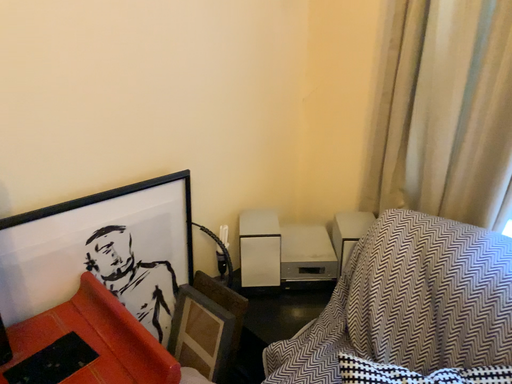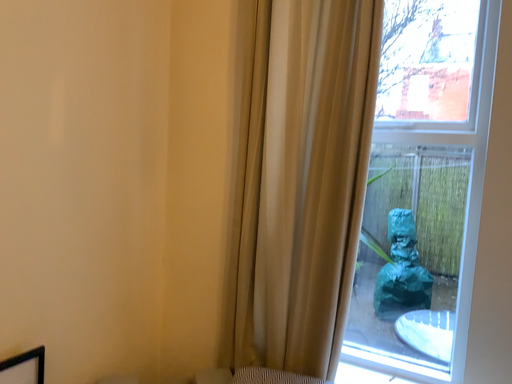
Question: How did the camera likely rotate when shooting the video?

Choices:
 (A) rotated left
 (B) rotated right

Answer: (B)